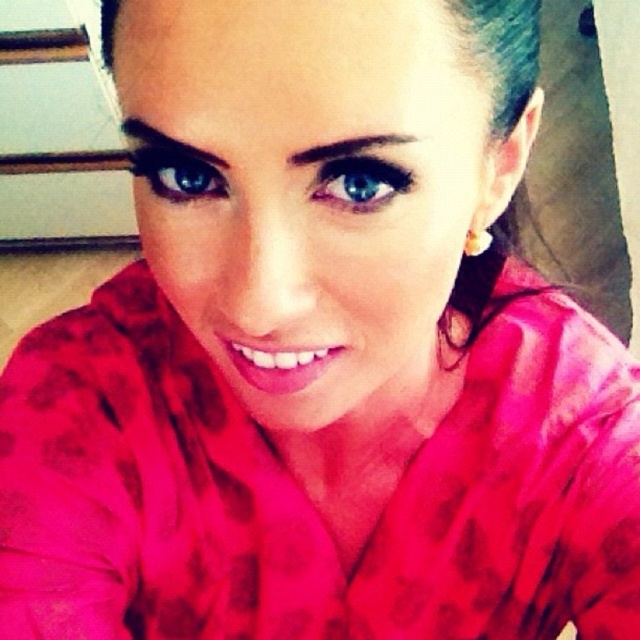
Between blue glossy eye at center and blue glossy eye at upper center, which one is positioned lower?

blue glossy eye at center

Is blue glossy eye at center positioned behind blue glossy eye at upper center?

No.

Between point (365, 164) and point (150, 164), which one is positioned in front?

Point (365, 164) is in front.

Locate an element on the screen. This screenshot has width=640, height=640. blue glossy eye at center is located at coordinates (355, 179).